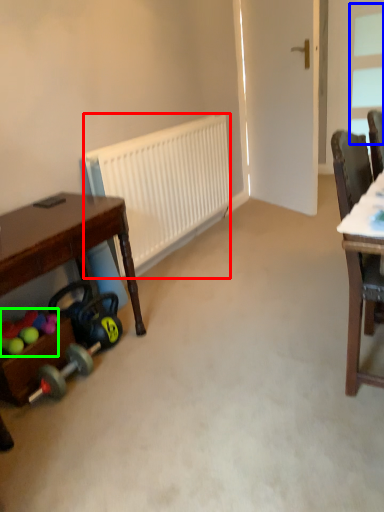
Question: Which object is the closest to the radiator (highlighted by a red box)? Choose among these: window (highlighted by a blue box) or toy (highlighted by a green box).

Choices:
 (A) window
 (B) toy

Answer: (B)